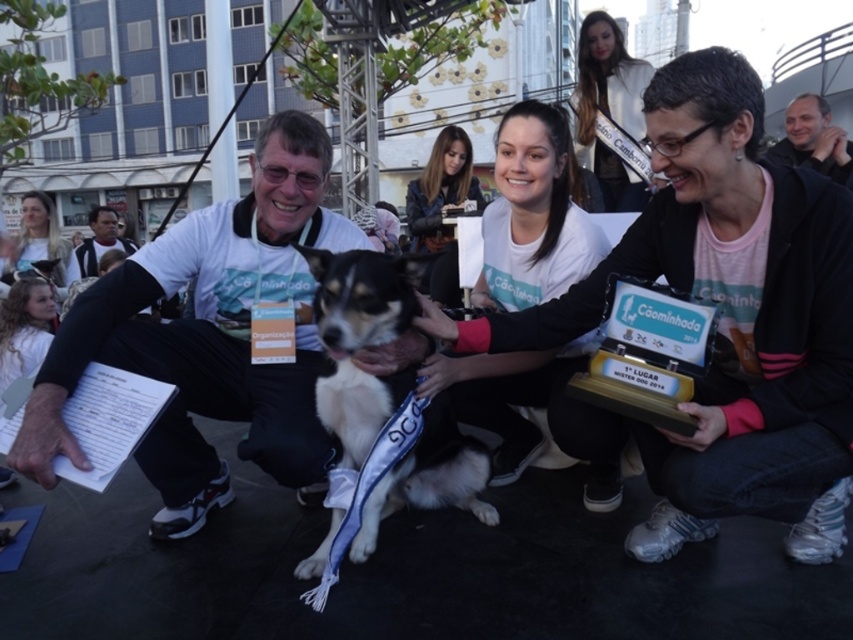
Question: In this image, where is metallic trophy at center located relative to white satin sash at upper center?

Choices:
 (A) right
 (B) left

Answer: (B)

Question: Which object is farther from the camera taking this photo?

Choices:
 (A) white fabric shirt at left
 (B) white matte shirt at center

Answer: (B)

Question: Which object is farther from the camera taking this photo?

Choices:
 (A) light brown hair at upper left
 (B) metallic trophy at center
 (C) white fabric shirt at left

Answer: (A)

Question: Estimate the real-world distances between objects in this image. Which object is farther from the black and white fur at center?

Choices:
 (A) smooth black shirt at upper right
 (B) smooth brown leather jacket at upper center

Answer: (A)

Question: Is metallic trophy at center positioned at the back of black and white fur at center?

Choices:
 (A) no
 (B) yes

Answer: (B)

Question: Is white fabric shirt at left to the left of white satin sash at upper center from the viewer's perspective?

Choices:
 (A) yes
 (B) no

Answer: (A)